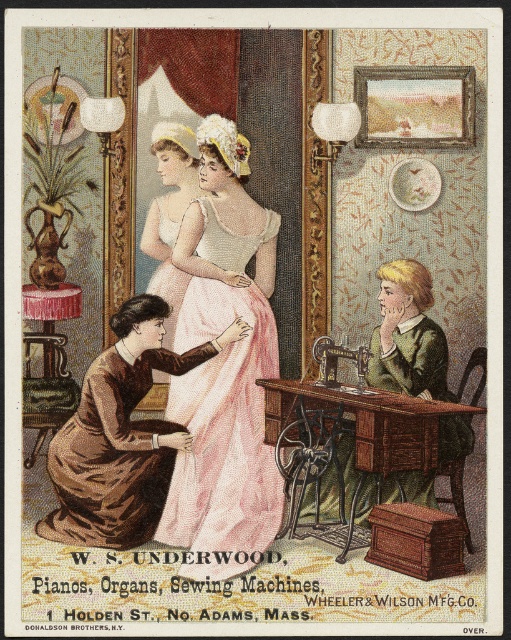
Which of these two, brown satin dress at lower left or metallic silver sewing machine at center, stands taller?

brown satin dress at lower left is taller.

Who is shorter, brown satin dress at lower left or metallic silver sewing machine at center?

metallic silver sewing machine at center is shorter.

At what (x,y) coordinates should I click in order to perform the action: click on brown satin dress at lower left. Please return your answer as a coordinate pair (x, y). Looking at the image, I should click on (121, 435).

Can you confirm if pink satin dress at center is positioned to the right of metallic silver sewing machine at center?

Incorrect, pink satin dress at center is not on the right side of metallic silver sewing machine at center.

Find the location of a particular element. The width and height of the screenshot is (511, 640). pink satin dress at center is located at coordinates point(223,413).

Is brown satin dress at lower left thinner than matte white dress at center?

In fact, brown satin dress at lower left might be wider than matte white dress at center.

Does point (73, 428) come behind point (180, 177)?

No, it is not.

The width and height of the screenshot is (511, 640). Find the location of `brown satin dress at lower left`. brown satin dress at lower left is located at coordinates (121, 435).